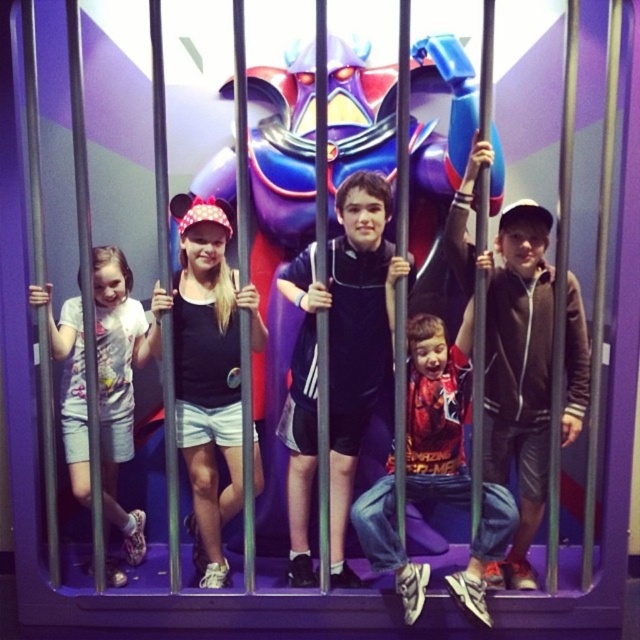
The image size is (640, 640). Describe the element at coordinates (512, 353) in the screenshot. I see `brown fleece jacket at center` at that location.

Between brown fleece jacket at center and black matte shorts at center, which one appears on the right side from the viewer's perspective?

Positioned to the right is brown fleece jacket at center.

Which is behind, point (506, 282) or point (333, 515)?

Point (333, 515)

Image resolution: width=640 pixels, height=640 pixels. I want to click on brown fleece jacket at center, so click(512, 353).

Between reddish-orange jersey at center and white cotton shirt at left, which one is positioned higher?

white cotton shirt at left is higher up.

Can you confirm if reddish-orange jersey at center is bigger than white cotton shirt at left?

Incorrect, reddish-orange jersey at center is not larger than white cotton shirt at left.

Who is more forward, (449,408) or (77,460)?

Point (449,408) is more forward.

Find the location of a particular element. This screenshot has width=640, height=640. reddish-orange jersey at center is located at coordinates (436, 406).

You are a GUI agent. You are given a task and a screenshot of the screen. Output one action in this format:
    pyautogui.click(x=<x>, y=<y>)
    Task: Click on the black matte shorts at center
    The image size is (640, 640).
    Given the screenshot: What is the action you would take?
    pyautogui.click(x=337, y=364)

Does black matte shorts at center have a smaller size compared to white cotton shirt at left?

Indeed, black matte shorts at center has a smaller size compared to white cotton shirt at left.

Identify the location of black matte shorts at center. This screenshot has width=640, height=640. (337, 364).